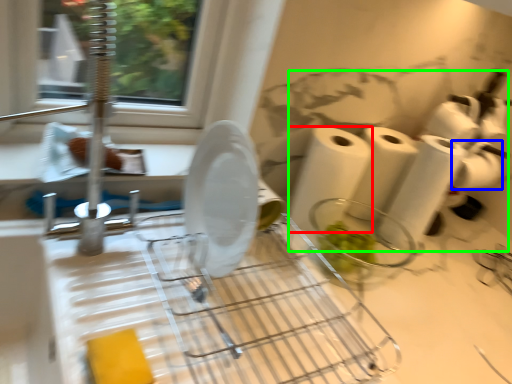
Question: Estimate the real-world distances between objects in this image. Which object is farther from paper towel (highlighted by a red box), toilet paper (highlighted by a blue box) or toilet paper (highlighted by a green box)?

Choices:
 (A) toilet paper
 (B) toilet paper

Answer: (A)